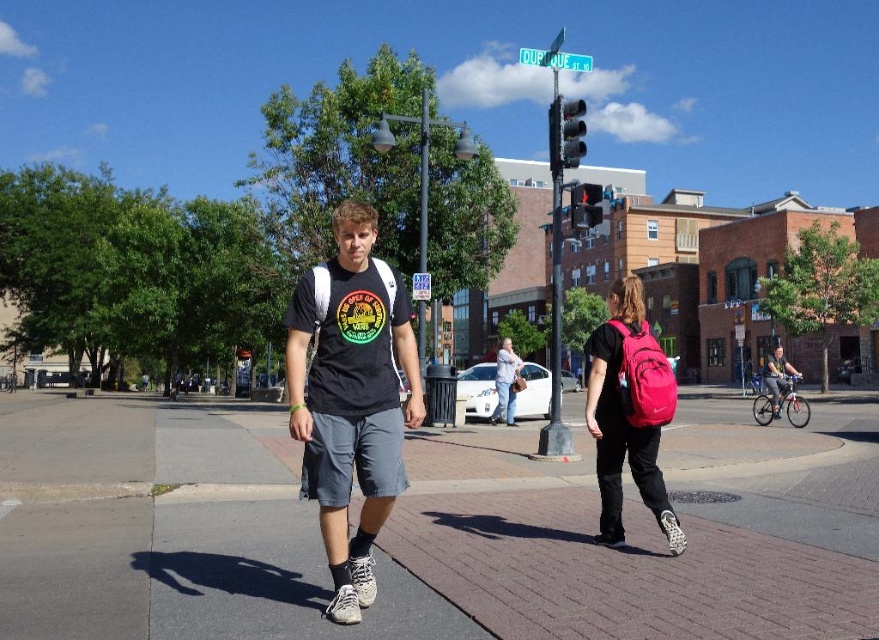
Question: Which of the following is the closest to the observer?

Choices:
 (A) brick pavement at center
 (B) matte black bicycle at right

Answer: (A)

Question: Considering the relative positions of pink fabric backpack at lower right and matte black backpack at center in the image provided, where is pink fabric backpack at lower right located with respect to matte black backpack at center?

Choices:
 (A) left
 (B) right

Answer: (B)

Question: Among these objects, which one is nearest to the camera?

Choices:
 (A) matte black bicycle at right
 (B) matte black t-shirt at center

Answer: (B)

Question: Can you confirm if pink fabric backpack at lower right is positioned to the right of matte black bicycle at right?

Choices:
 (A) no
 (B) yes

Answer: (A)

Question: Which point appears farthest from the camera in this image?

Choices:
 (A) (609, 499)
 (B) (514, 362)

Answer: (B)

Question: Can you confirm if brick pavement at center is positioned to the left of matte black t-shirt at center?

Choices:
 (A) no
 (B) yes

Answer: (B)